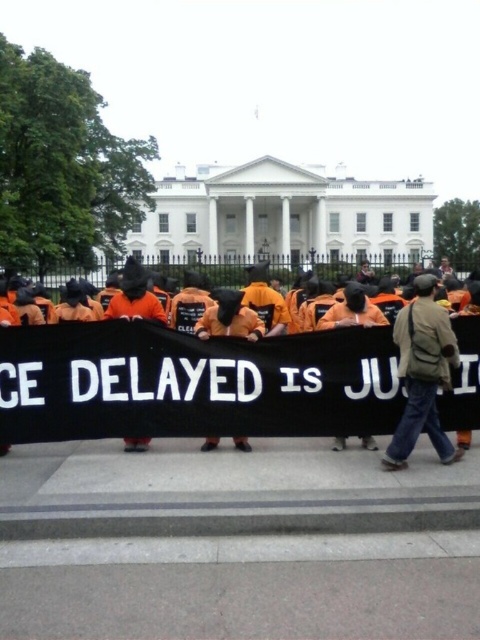
You are a photographer standing in front of the White House. You notice an orange fabric at center and a brown fabric jacket at center. Which one is closer to you?

The orange fabric at center is closer to you because the brown fabric jacket at center is behind it.

From the picture: You are a photographer trying to capture the protest scene. You notice the orange fabric at center and the brown fabric jacket at center. Which object should you focus on to ensure it fits entirely within your camera frame if your frame can only accommodate the width of the narrower object?

The orange fabric at center has a larger width than the brown fabric jacket at center. Since your camera frame can only accommodate the narrower object, you should focus on the brown fabric jacket at center to ensure it fits entirely within the frame.